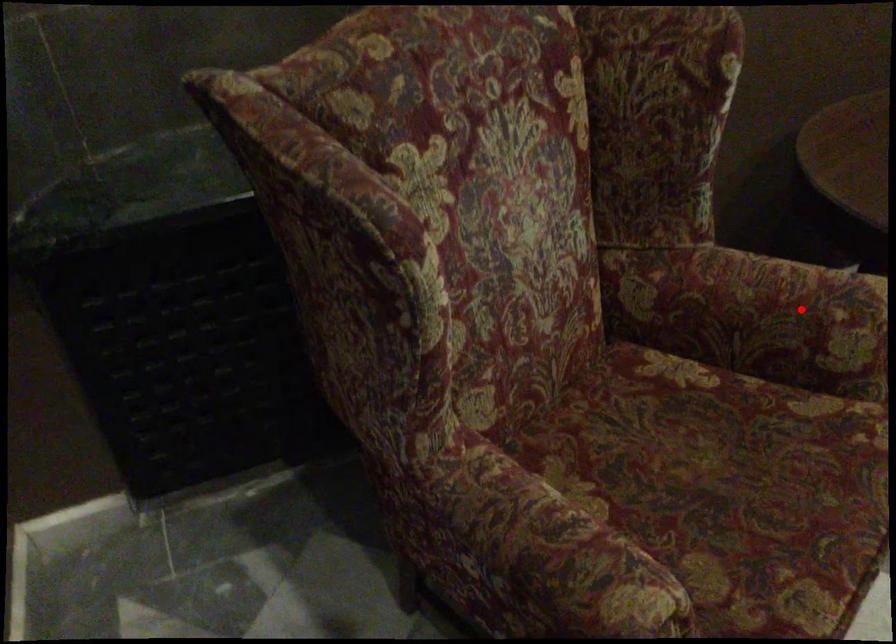
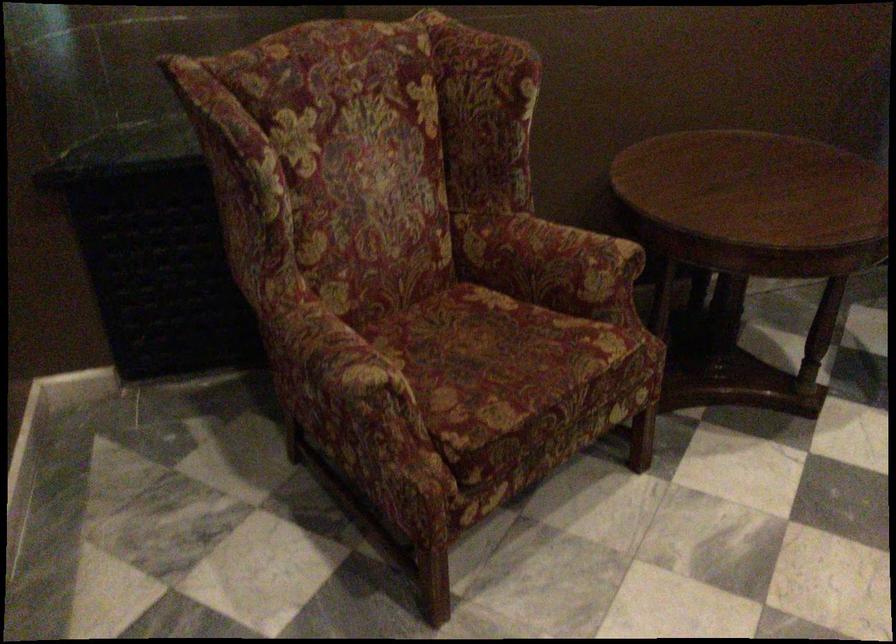
Question: A red point is marked in image1. In image2, is the corresponding 3D point closer to the camera or farther? Reply with the corresponding letter.

Choices:
 (A) The corresponding 3D point is closer.
 (B) The corresponding 3D point is farther.

Answer: (B)